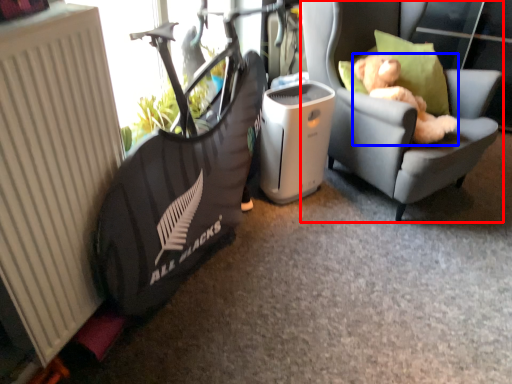
Question: Which point is closer to the camera, chair (highlighted by a red box) or animal (highlighted by a blue box)?

Choices:
 (A) chair
 (B) animal

Answer: (A)